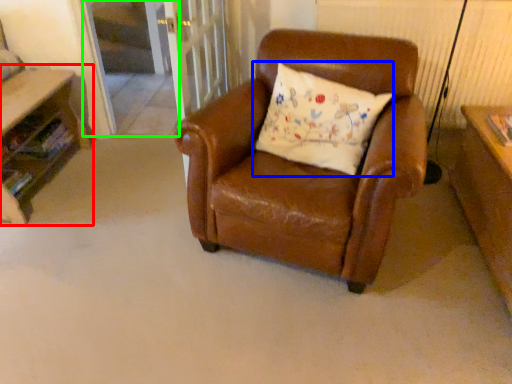
Question: Considering the real-world distances, which object is farthest from table (highlighted by a red box)? pillow (highlighted by a blue box) or screen door (highlighted by a green box)?

Choices:
 (A) pillow
 (B) screen door

Answer: (A)